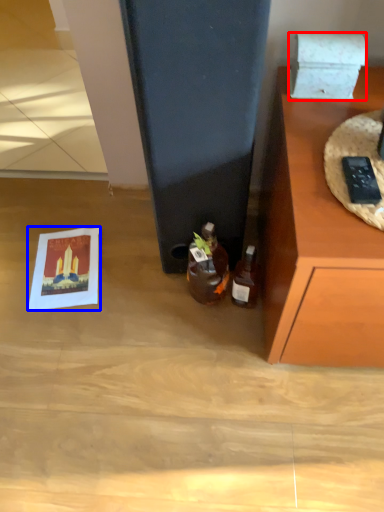
Question: Which object is closer to the camera taking this photo, box (highlighted by a red box) or postcard (highlighted by a blue box)?

Choices:
 (A) box
 (B) postcard

Answer: (A)